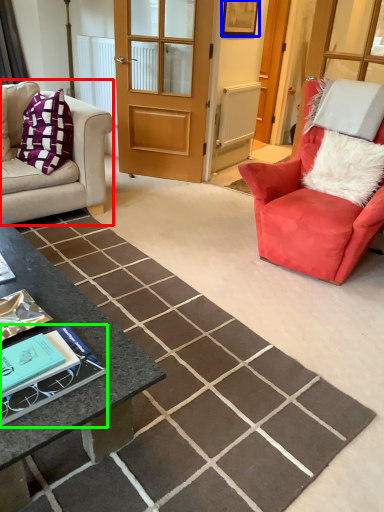
Question: Based on their relative distances, which object is nearer to studio couch (highlighted by a red box)? Choose from picture frame (highlighted by a blue box) and book (highlighted by a green box).

Choices:
 (A) picture frame
 (B) book

Answer: (A)